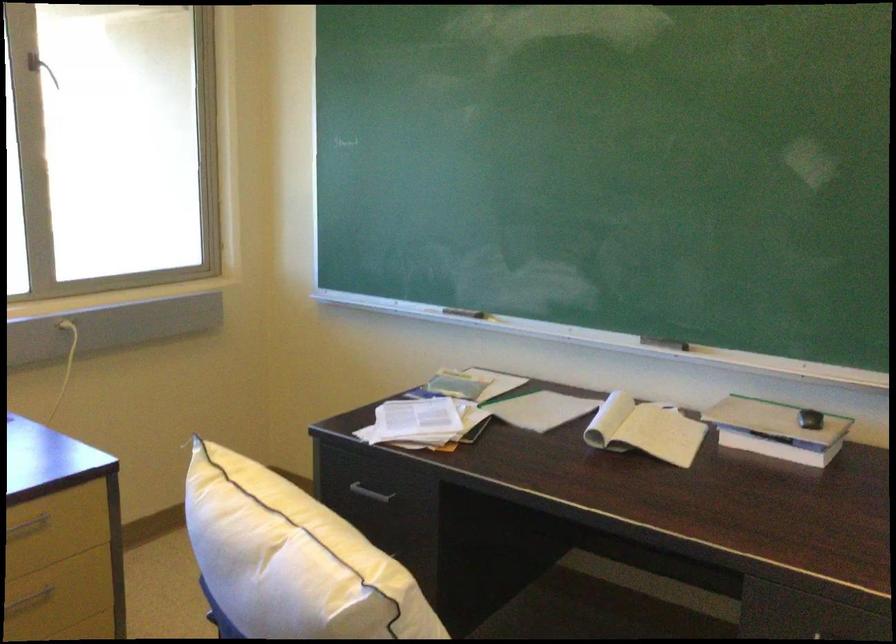
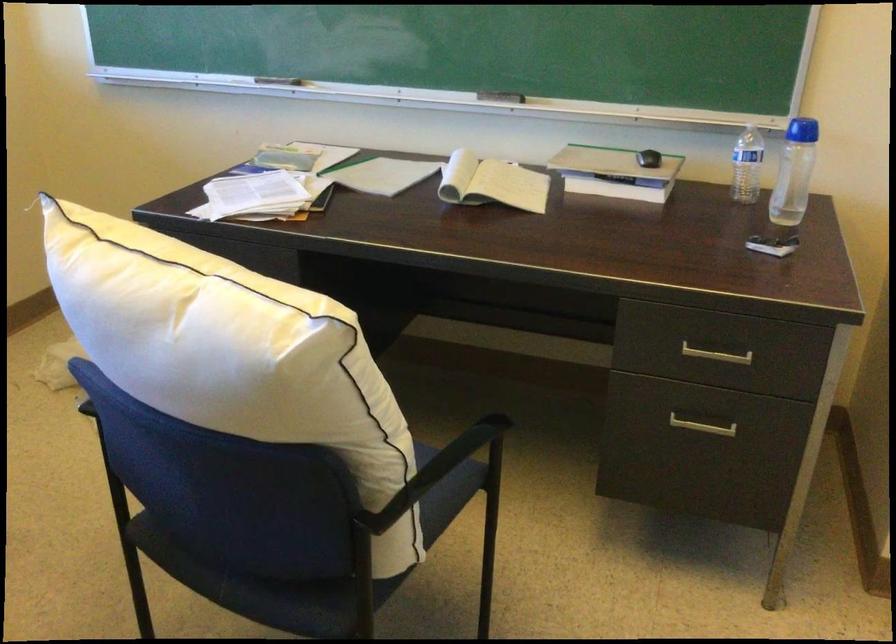
Find the pixel in the second image that matches point 463,307 in the first image.

(279, 80)